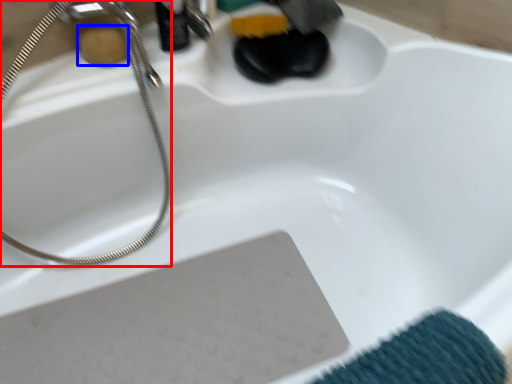
Question: Which object is closer to the camera taking this photo, shower (highlighted by a red box) or soap (highlighted by a blue box)?

Choices:
 (A) shower
 (B) soap

Answer: (A)